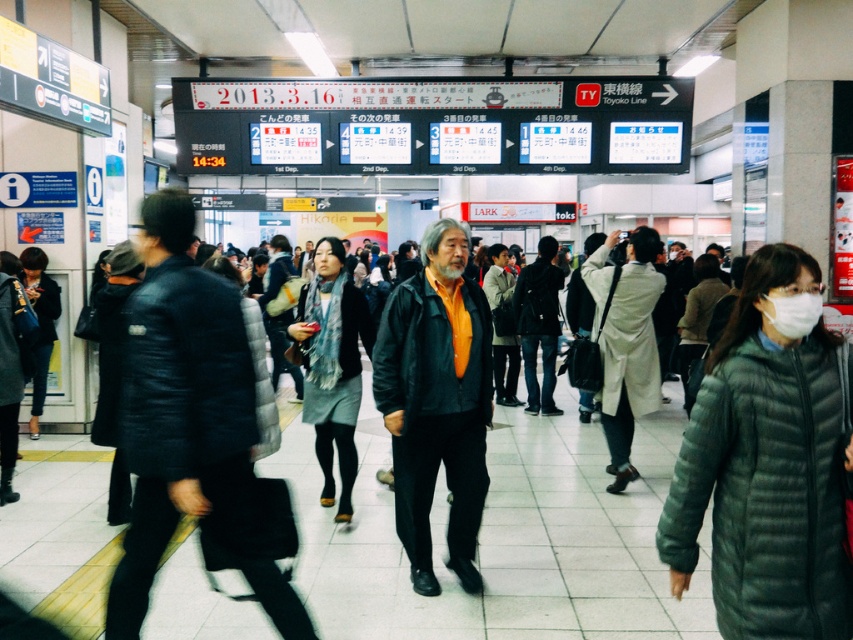
Does gray down jacket at right have a lesser height compared to leather jacket at center?

No, gray down jacket at right is not shorter than leather jacket at center.

Based on the photo, is gray down jacket at right below leather jacket at center?

Actually, gray down jacket at right is above leather jacket at center.

Between point (695, 410) and point (160, 243), which one is positioned behind?

Point (160, 243)

The height and width of the screenshot is (640, 853). What are the coordinates of `gray down jacket at right` in the screenshot? It's located at (766, 464).

Image resolution: width=853 pixels, height=640 pixels. What do you see at coordinates (436, 401) in the screenshot? I see `matte black jacket at center` at bounding box center [436, 401].

Is matte black jacket at center positioned behind light beige coat at center?

No.

Does point (465, 545) come closer to viewer compared to point (622, 358)?

Yes, it is in front of point (622, 358).

Where is `matte black jacket at center`? The image size is (853, 640). matte black jacket at center is located at coordinates (436, 401).

Which is more to the right, matte black jacket at center or leather jacket at center?

matte black jacket at center is more to the right.

Who is lower down, matte black jacket at center or leather jacket at center?

leather jacket at center is below.

Is point (402, 525) less distant than point (154, 221)?

That is False.

Image resolution: width=853 pixels, height=640 pixels. I want to click on matte black jacket at center, so click(436, 401).